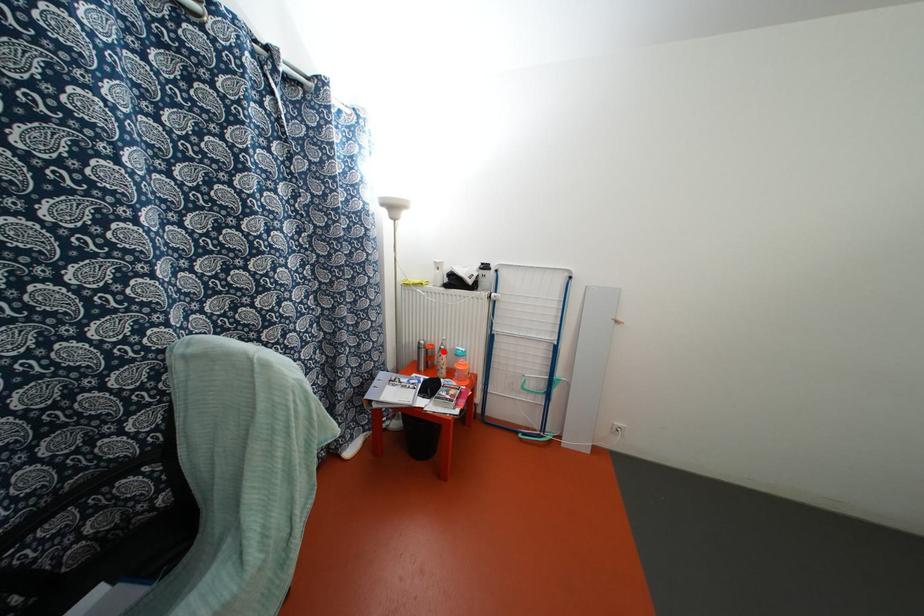
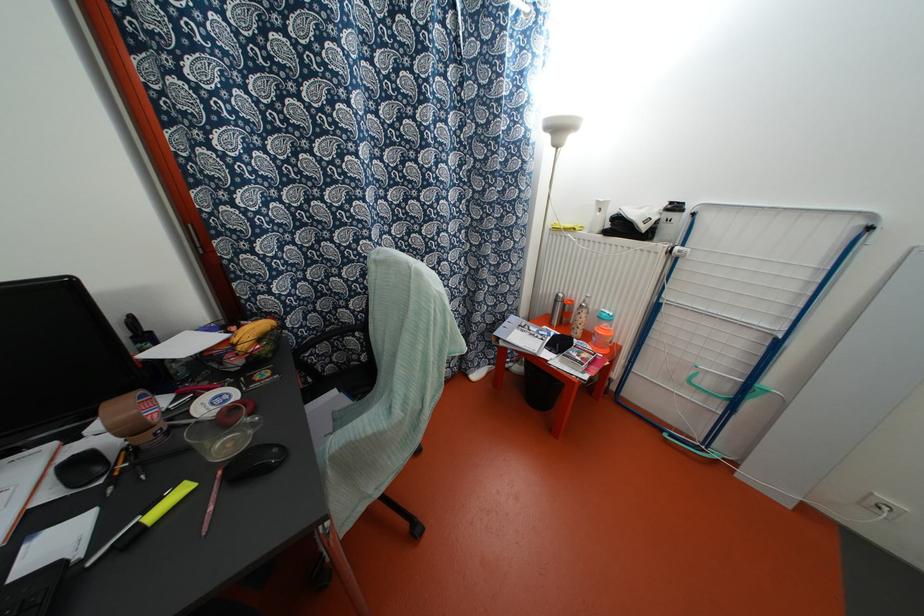
Question: I am providing you with two images of the same scene from different viewpoints. Given a red point in image1, look at the same physical point in image2. Is it:

Choices:
 (A) Closer to the viewpoint
 (B) Farther from the viewpoint

Answer: (A)